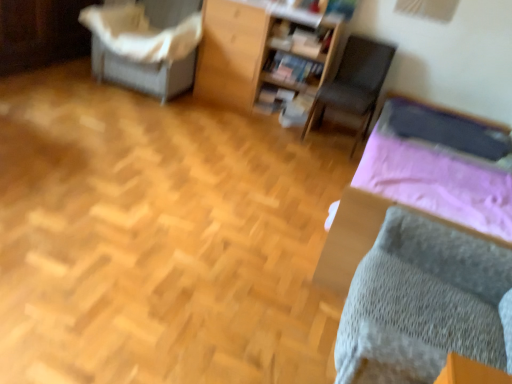
Where is `vacant space in front of white fabric-covered chair at upper left, which is counted as the first furniture, starting from the left`? This screenshot has height=384, width=512. vacant space in front of white fabric-covered chair at upper left, which is counted as the first furniture, starting from the left is located at coordinates (116, 112).